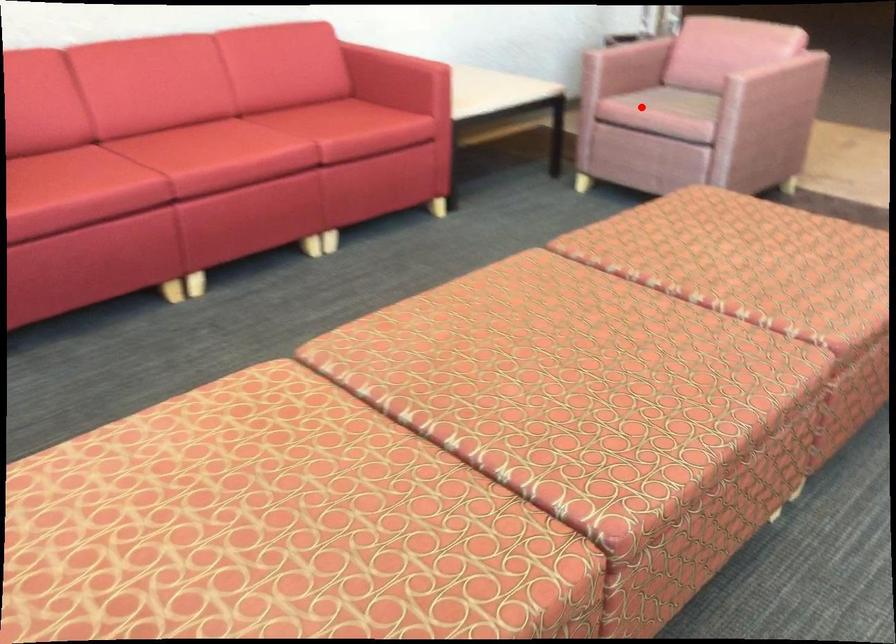
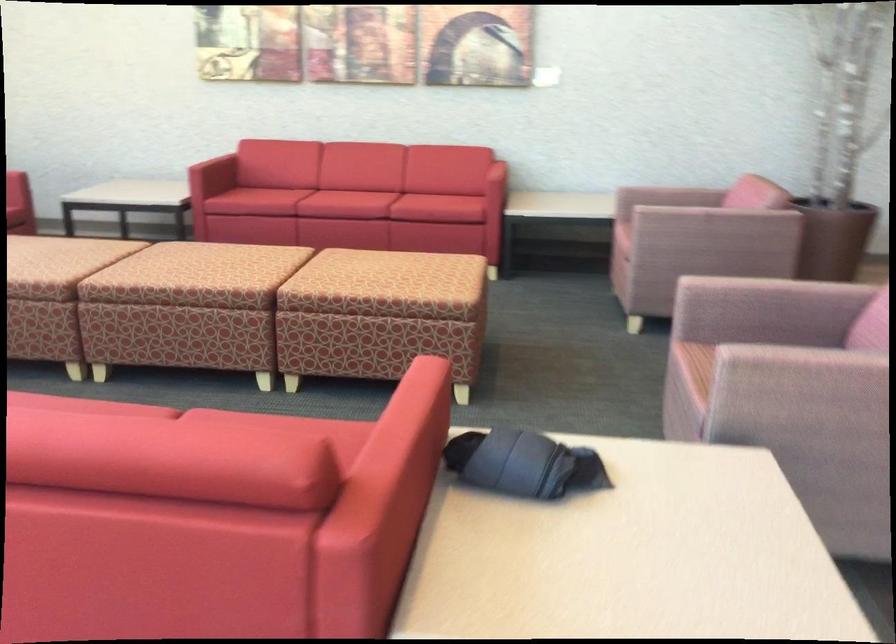
Question: I am providing you with two images of the same scene from different viewpoints. Given a red point in image1, look at the same physical point in image2. Is it:

Choices:
 (A) Closer to the viewpoint
 (B) Farther from the viewpoint

Answer: (B)